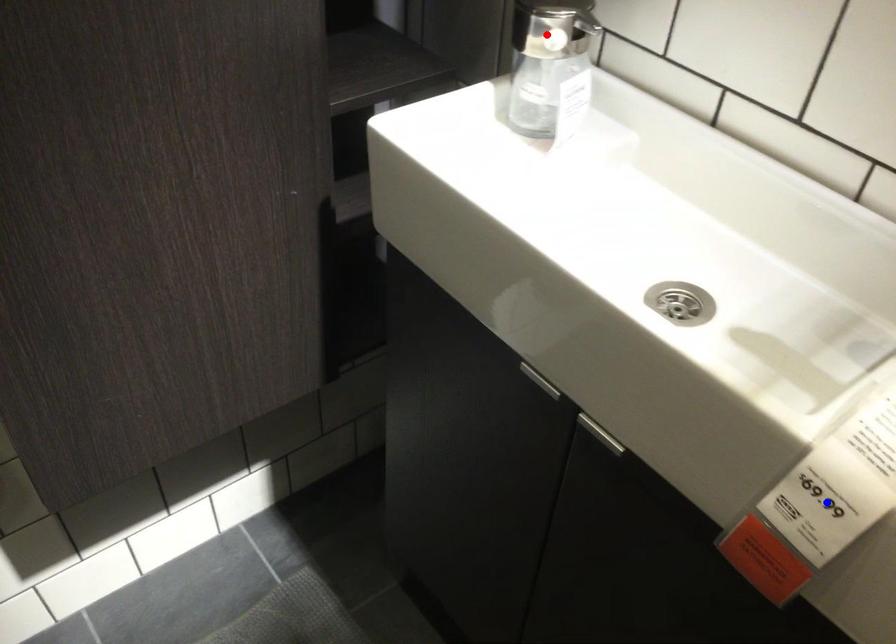
Question: Two points are marked on the image. Which point is closer to the camera?

Choices:
 (A) Blue point is closer.
 (B) Red point is closer.

Answer: (A)